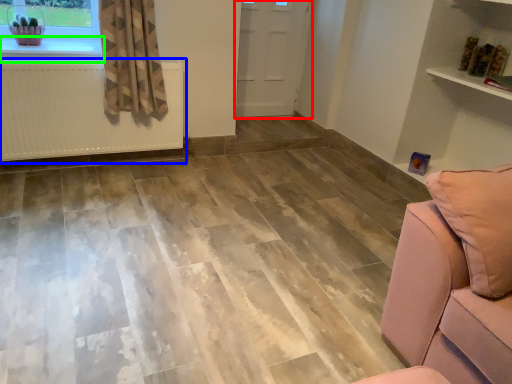
Question: Estimate the real-world distances between objects in this image. Which object is farther from door (highlighted by a red box), radiator (highlighted by a blue box) or window sill (highlighted by a green box)?

Choices:
 (A) radiator
 (B) window sill

Answer: (B)